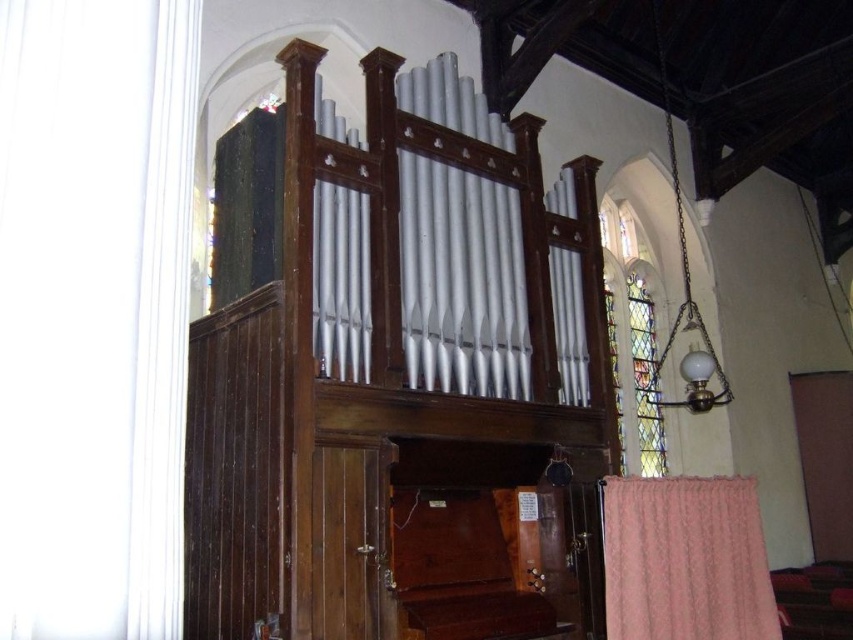
Who is positioned more to the right, pink knitted curtain at lower right or stained glass at upper right?

stained glass at upper right is more to the right.

Consider the image. Can you confirm if pink knitted curtain at lower right is smaller than stained glass at upper right?

Yes.

Does point (616, 566) come farther from viewer compared to point (645, 328)?

No, it is not.

Image resolution: width=853 pixels, height=640 pixels. Find the location of `pink knitted curtain at lower right`. pink knitted curtain at lower right is located at coordinates (685, 560).

In the scene shown: Does metallic silver pipes at center have a larger size compared to black velvet curtain at upper left?

Yes, metallic silver pipes at center is bigger than black velvet curtain at upper left.

Does point (259, 536) come in front of point (263, 163)?

Yes, it is.

Identify the location of metallic silver pipes at center. (401, 378).

Is metallic silver pipes at center further to the viewer compared to pink knitted curtain at lower right?

No, metallic silver pipes at center is in front of pink knitted curtain at lower right.

Which is more to the right, metallic silver pipes at center or pink knitted curtain at lower right?

pink knitted curtain at lower right

Based on the photo, who is more distant from viewer, (328, 499) or (706, 484)?

The point (706, 484) is more distant.

I want to click on metallic silver pipes at center, so click(x=401, y=378).